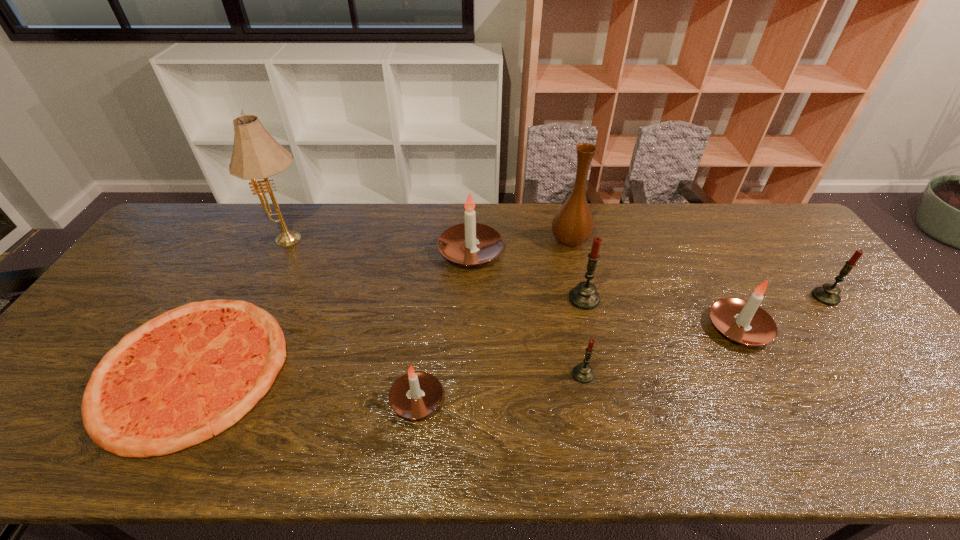
This screenshot has width=960, height=540. What are the coordinates of `lampshade` in the screenshot? It's located at (256, 154).

The height and width of the screenshot is (540, 960). I want to click on beige lampshade, so click(x=256, y=154).

This screenshot has height=540, width=960. I want to click on the eighth shortest object, so click(x=573, y=225).

The height and width of the screenshot is (540, 960). Find the location of `brown vase`. brown vase is located at coordinates (573, 225).

Where is `the biggest red candle`? the biggest red candle is located at coordinates (584, 296).

Where is `the biggest white candle`? The width and height of the screenshot is (960, 540). the biggest white candle is located at coordinates (458, 243).

Where is `the farthest candle`? the farthest candle is located at coordinates (458, 243).

This screenshot has height=540, width=960. I want to click on the rightmost object, so click(x=828, y=294).

Find the location of a particular element. The height and width of the screenshot is (540, 960). the rightmost candle is located at coordinates (828, 294).

This screenshot has height=540, width=960. What are the coordinates of `the second biggest white candle` in the screenshot? It's located at (742, 321).